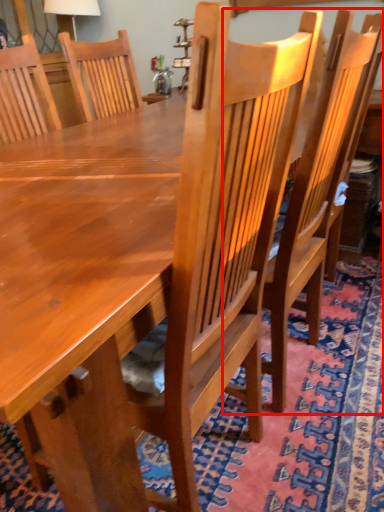
Question: Where is chair (annotated by the red box) located in relation to mat in the image?

Choices:
 (A) right
 (B) left

Answer: (A)